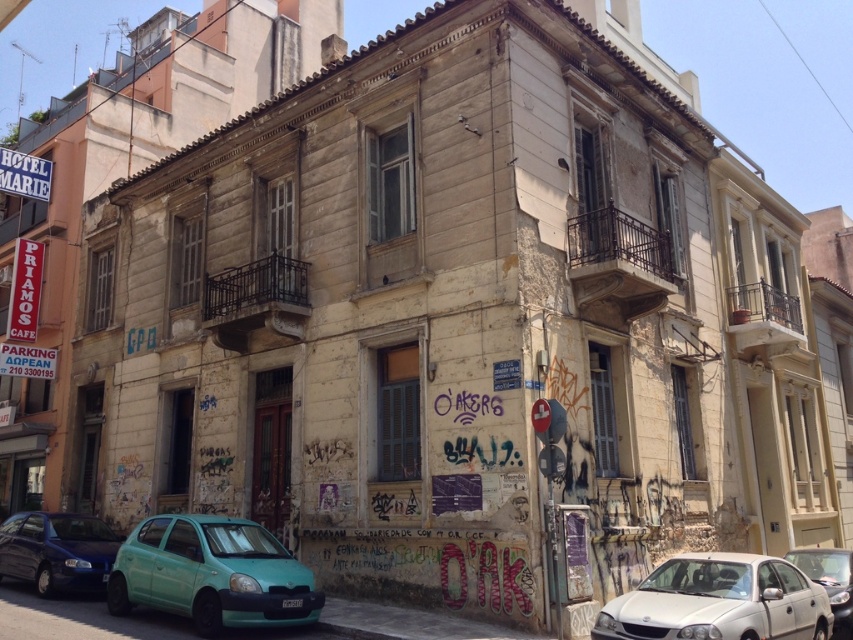
You are a pedestrian standing at the corner of the building and want to cross the street. You see a teal matte hatchback at lower left and a white matte sedan at lower right. Which car is closer to you?

The teal matte hatchback at lower left is closer to you since the white matte sedan at lower right is behind it.

You are a delivery person trying to park your vehicle in the parking lot near the building. You see the teal matte hatchback at lower left and the metallic silver sedan at lower right. Which vehicle is positioned closer to the entrance of the building?

The teal matte hatchback at lower left is above the metallic silver sedan at lower right, so the teal matte hatchback at lower left is closer to the entrance of the building since it is positioned higher up near the building.